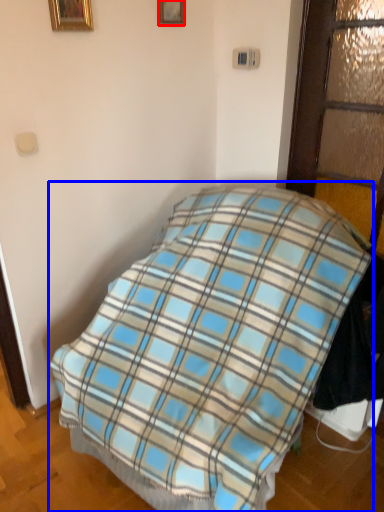
Question: Among these objects, which one is farthest to the camera, picture frame (highlighted by a red box) or bed (highlighted by a blue box)?

Choices:
 (A) picture frame
 (B) bed

Answer: (A)